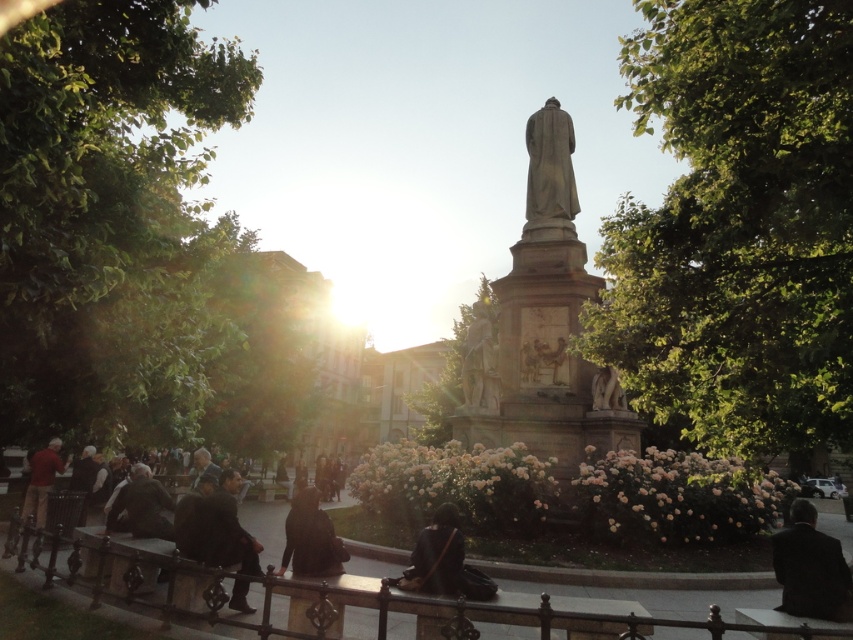
You are standing at the monument and want to take a photo of both the point at coordinates (786,560) and the point at (473,352). Which point will appear larger in your camera view?

Point at coordinates (786,560) will appear larger in your camera view because it is closer to the camera than point at (473,352).

You are standing at the monument and want to walk towards the exit located at point (x=614, y=371). There is an obstacle at point (x=784, y=538). Will you encounter the obstacle before reaching the exit?

Point (x=784, y=538) is in front of point (x=614, y=371), so yes, you will encounter the obstacle at point (x=784, y=538) before reaching the exit at point (x=614, y=371).

You are a park visitor who wants to sit on a bench near the monument. You have a backpack with a volume of 30 liters. You see the dark fabric coat at center and the red sweater at left. Which item can you store in your backpack without exceeding its capacity?

The dark fabric coat at center has a larger size compared to red sweater at left, so the red sweater at left is smaller and can fit into the 30 liters backpack. The dark fabric coat at center may be too large to fit.